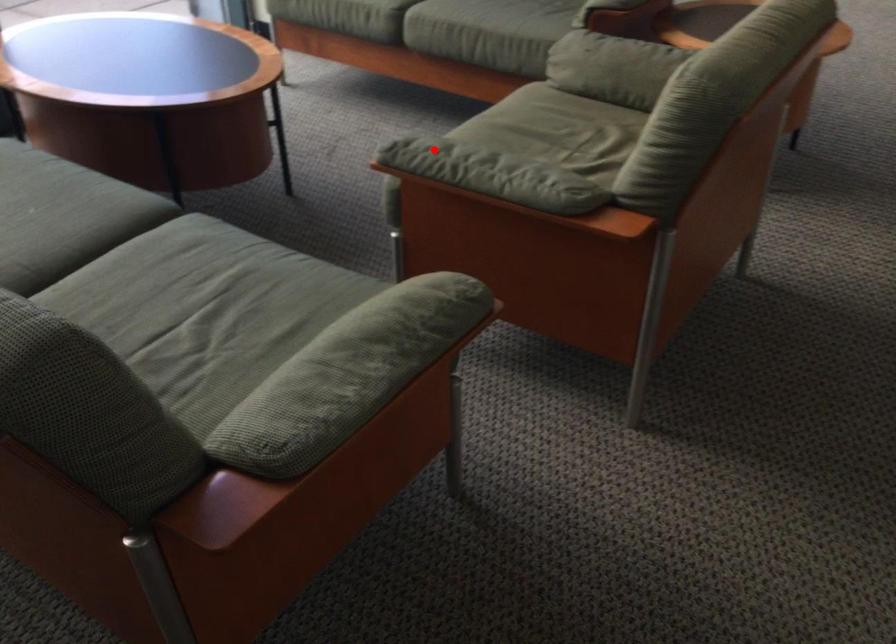
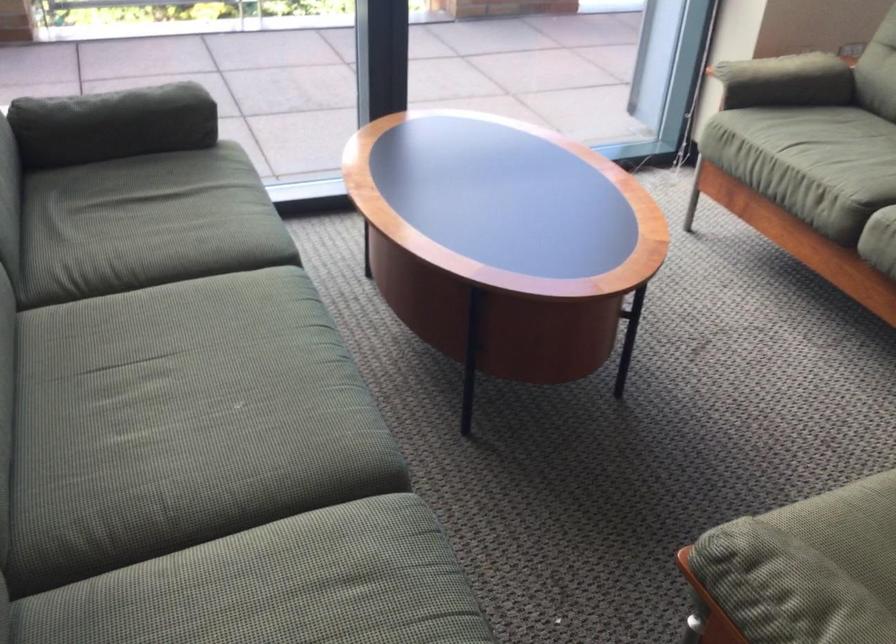
In the second image, find the point that corresponds to the highlighted location in the first image.

(785, 588)